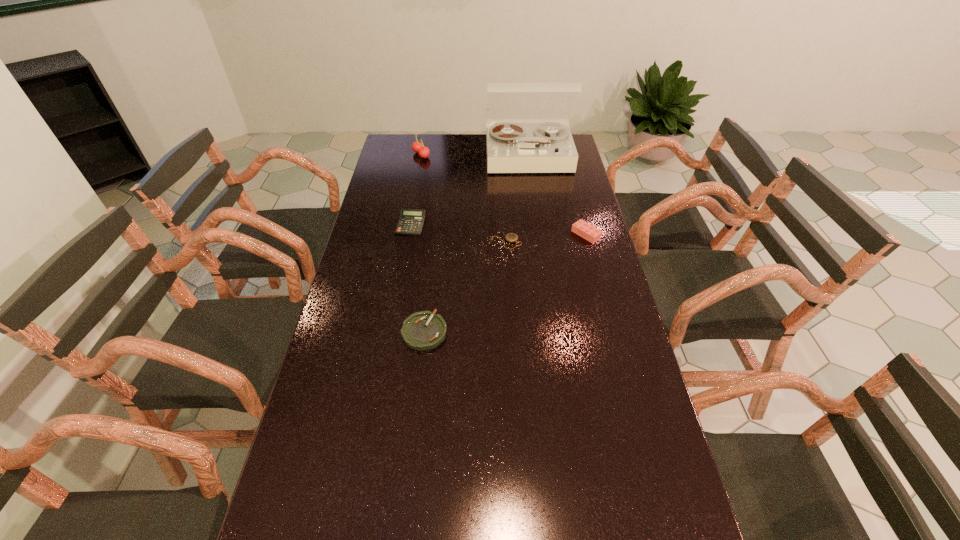
The image size is (960, 540). I want to click on vacant area located on the right of the calculator, so click(475, 225).

I want to click on vacant space located 0.140m on the right of the ashtray, so click(496, 332).

This screenshot has height=540, width=960. Identify the location of vacant space located 0.250m on the left of the shortest object. (419, 242).

Find the location of `record player present at the far edge`. record player present at the far edge is located at coordinates (511, 148).

I want to click on cherry that is at the far edge, so click(x=417, y=147).

Where is `cherry at the left edge`? This screenshot has width=960, height=540. cherry at the left edge is located at coordinates (417, 147).

Locate an element on the screen. The height and width of the screenshot is (540, 960). calculator present at the left edge is located at coordinates (411, 221).

Locate an element on the screen. The image size is (960, 540). record player positioned at the right edge is located at coordinates (511, 148).

Locate an element on the screen. The height and width of the screenshot is (540, 960). Lego that is at the right edge is located at coordinates pyautogui.click(x=592, y=234).

The image size is (960, 540). Identify the location of object present at the far left corner. (417, 147).